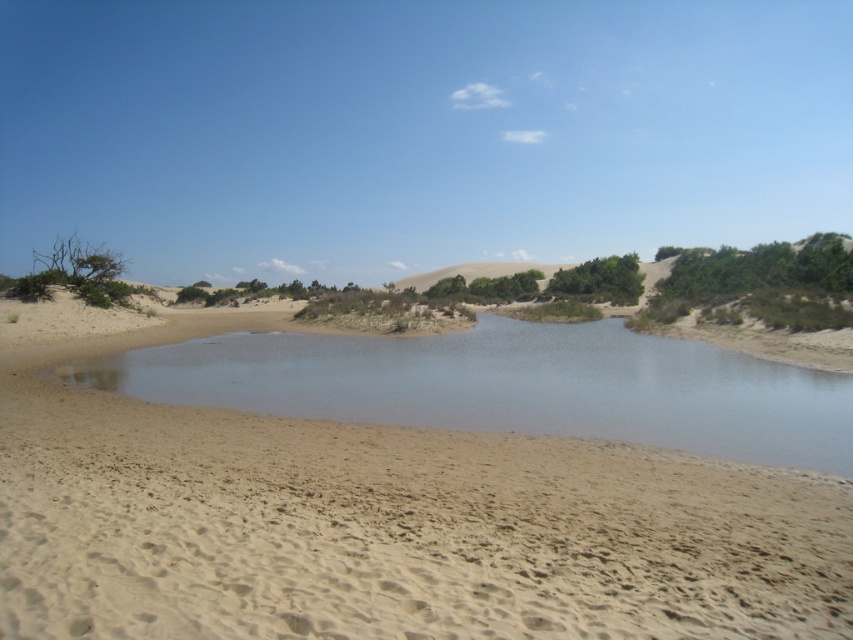
Question: Which of the following is the farthest from the observer?

Choices:
 (A) (421, 433)
 (B) (167, 364)

Answer: (B)

Question: Which point is closer to the camera?

Choices:
 (A) (614, 356)
 (B) (271, 467)

Answer: (B)

Question: Is light brown sandy beach at center above clear water at center?

Choices:
 (A) no
 (B) yes

Answer: (B)

Question: Is light brown sandy beach at center above clear water at center?

Choices:
 (A) yes
 (B) no

Answer: (A)

Question: Which object appears closest to the camera in this image?

Choices:
 (A) light brown sandy beach at center
 (B) clear water at center

Answer: (A)

Question: Can you confirm if light brown sandy beach at center is smaller than clear water at center?

Choices:
 (A) yes
 (B) no

Answer: (B)